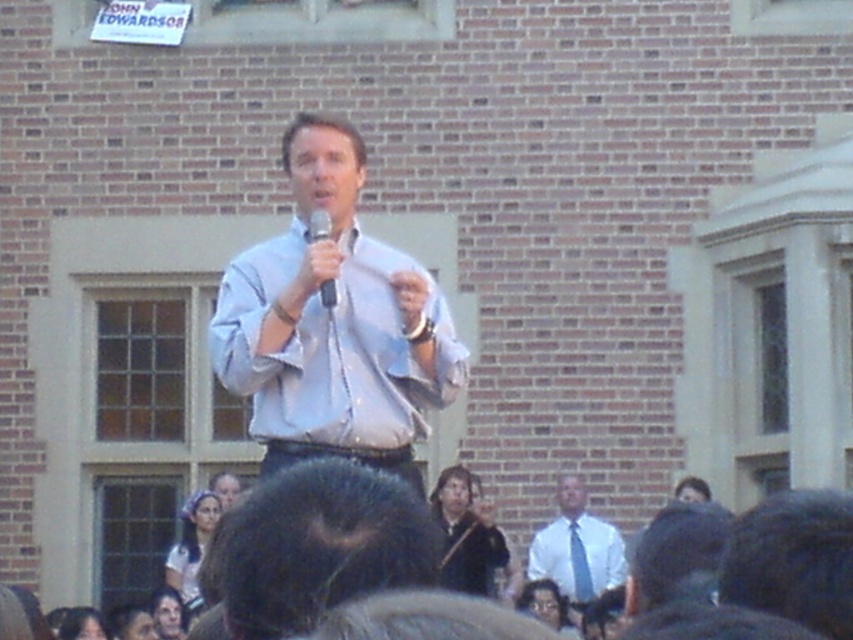
Question: Estimate the real-world distances between objects in this image. Which object is farther from the white matte microphone at center?

Choices:
 (A) dark hair at lower left
 (B) blue silk tie at center

Answer: (B)

Question: Can you confirm if light blue shirt at center is positioned above dark hair at lower left?

Choices:
 (A) yes
 (B) no

Answer: (A)

Question: Which point is farther to the camera?

Choices:
 (A) (430, 404)
 (B) (155, 602)
 (C) (86, 611)

Answer: (B)

Question: Which is farther from the light brown hair at lower left?

Choices:
 (A) white matte microphone at center
 (B) blue silk tie at center

Answer: (A)

Question: Is white shirt and tie at center positioned in front of blue silk tie at center?

Choices:
 (A) no
 (B) yes

Answer: (B)

Question: Is light blue cotton shirt at center above smooth skin face at lower left?

Choices:
 (A) no
 (B) yes

Answer: (B)